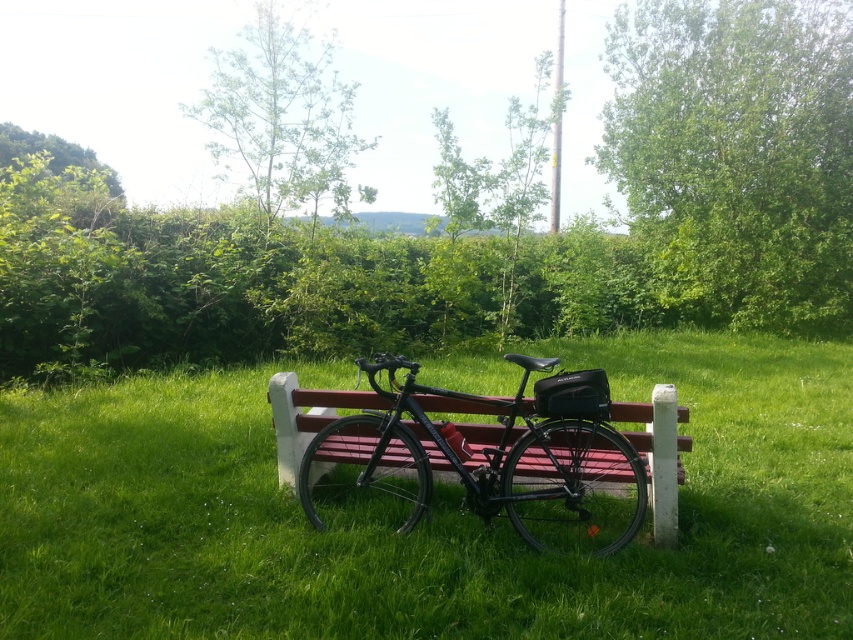
You are planning to install a new bench in the park between the green leafy tree at upper right and the green leafy tree at upper left. The bench you want to install is 15 feet long. Will there be enough space between the two trees to place the bench?

The distance between the green leafy tree at upper right and the green leafy tree at upper left is 26.08 feet. Since the bench is 15 feet long, there is sufficient space to place it between them.

You are standing in the park and see two points in the scene. Which point is closer to you, point (x=264, y=182) or point (x=38, y=144)?

Point (x=264, y=182) is closer to you than point (x=38, y=144).

You are planning to take a photo of the green leafy tree at upper right and the green leafy tree at upper left. Which tree is positioned lower in the image?

The green leafy tree at upper right is located below the green leafy tree at upper left, so it is positioned lower in the image.